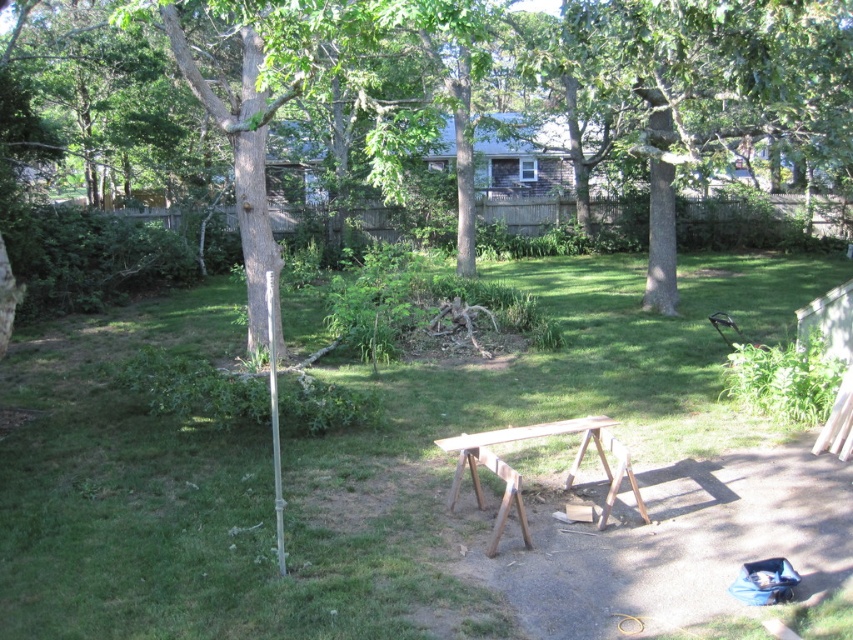
Looking at this image, you are standing in the backyard and want to place a small potted plant between the green grass at center and the silver metallic pole at left. Based on their positions, which object should the potted plant be closer to?

The green grass at center is closer to the viewer than the silver metallic pole at left, so the potted plant should be placed closer to the silver metallic pole at left to be between them.

You are a painter who needs to move a ladder from the wooden sawhorse at center to the silver metallic pole at left. The ladder is 8 feet long. Will it fit between them without bending?

The distance between the wooden sawhorse at center and the silver metallic pole at left is 7.96 feet, which is slightly less than the ladder length of 8 feet. Therefore, the ladder can fit between them without bending.

You are planning to place a new garden statue that requires a base taller than 2 meters. Given the wooden sawhorse at center and the silver metallic pole at left, which object could potentially serve as a suitable base?

The silver metallic pole at left is taller than the wooden sawhorse at center, so it could potentially serve as a suitable base for the garden statue requiring a base taller than 2 meters.